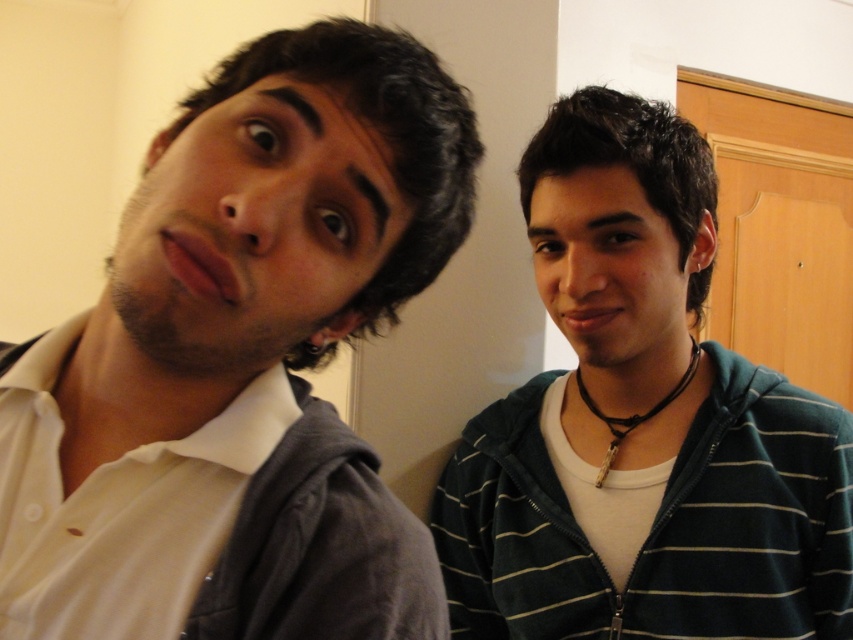
Question: Which of the following is the closest to the observer?

Choices:
 (A) (339, 516)
 (B) (683, 492)

Answer: (A)

Question: Which point is closer to the camera?

Choices:
 (A) (778, 416)
 (B) (317, 461)

Answer: (B)

Question: Does white matte shirt at left appear over striped hoodie at right?

Choices:
 (A) yes
 (B) no

Answer: (A)

Question: Which point appears farthest from the camera in this image?

Choices:
 (A) (544, 573)
 (B) (260, 572)

Answer: (A)

Question: Can you confirm if white matte shirt at left is bigger than striped hoodie at right?

Choices:
 (A) no
 (B) yes

Answer: (A)

Question: In this image, where is white matte shirt at left located relative to striped hoodie at right?

Choices:
 (A) right
 (B) left

Answer: (B)